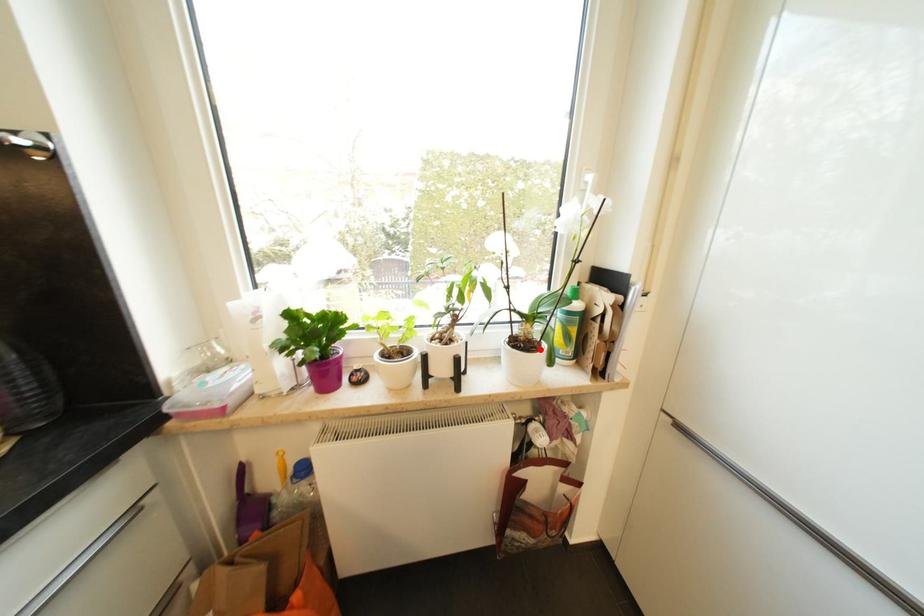
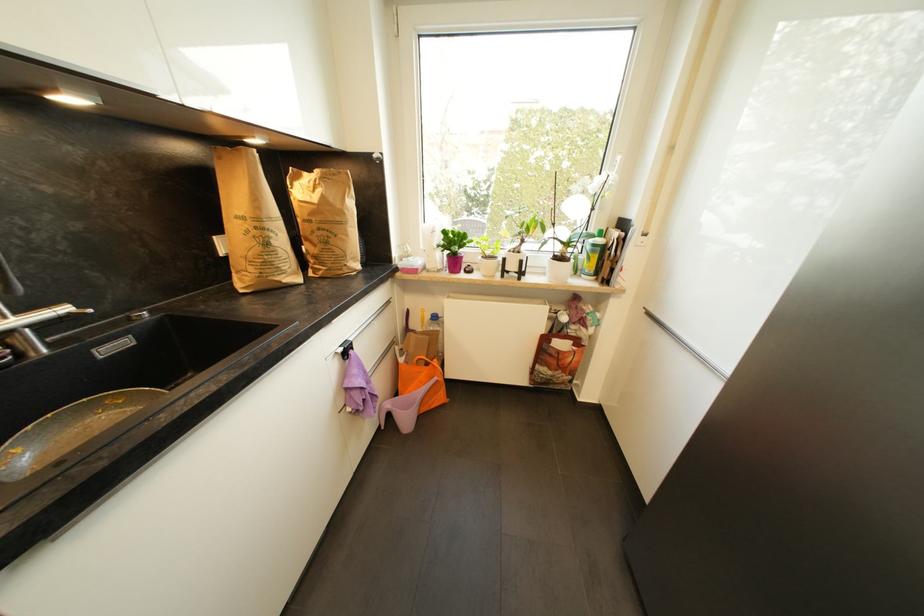
Where in the second image is the point corresponding to the highlighted location from the first image?

(570, 261)